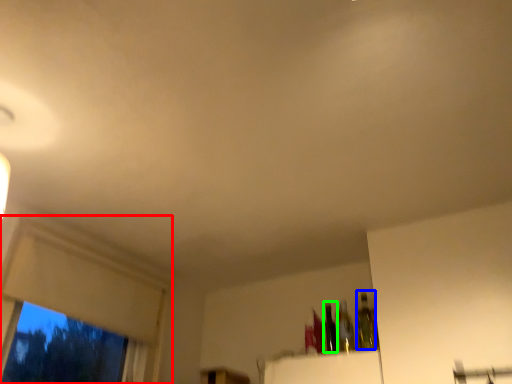
Question: Based on their relative distances, which object is nearer to window frame (highlighted by a red box)? Choose from bottle (highlighted by a blue box) and bottle (highlighted by a green box).

Choices:
 (A) bottle
 (B) bottle

Answer: (B)